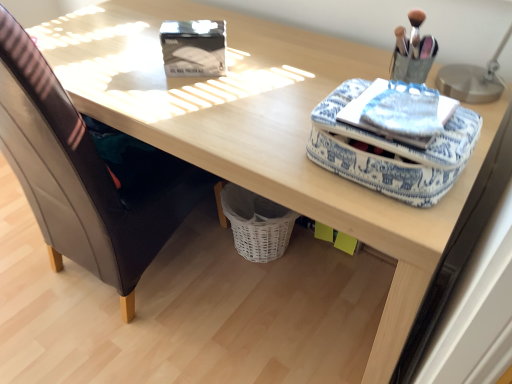
I want to click on free area behind blue fabric case at upper right, so click(x=309, y=82).